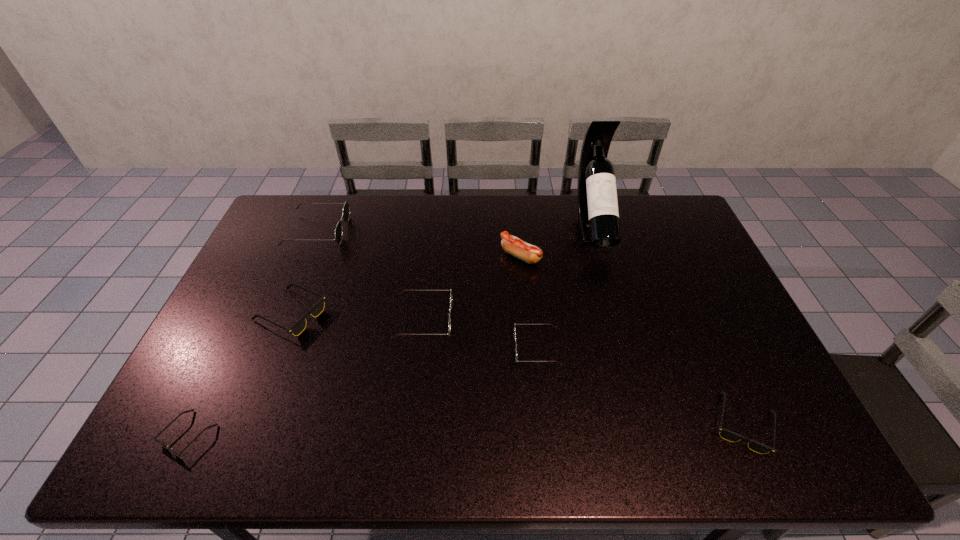
You are a GUI agent. You are given a task and a screenshot of the screen. Output one action in this format:
    pyautogui.click(x=<x>, y=<y>)
    Task: Click on the free space in the image that satisfies the following two spatial constraints: 1. on the front-facing side of the tallest sunglasses; 2. on the lenses of the smallest black sunglasses
    This screenshot has height=540, width=960.
    Given the screenshot: What is the action you would take?
    (232, 435)

Find the location of `vacant space that satisfies the following two spatial constraints: 1. on the stand of the black wine bottle; 2. on the front-facing side of the farthest green sunglasses`. vacant space that satisfies the following two spatial constraints: 1. on the stand of the black wine bottle; 2. on the front-facing side of the farthest green sunglasses is located at coordinates (594, 231).

You are a GUI agent. You are given a task and a screenshot of the screen. Output one action in this format:
    pyautogui.click(x=<x>, y=<y>)
    Task: Click on the free location that satisfies the following two spatial constraints: 1. on the stand of the second object from right to left; 2. on the front-facing side of the farthest green sunglasses
    The image size is (960, 540).
    Given the screenshot: What is the action you would take?
    pyautogui.click(x=594, y=231)

Locate an element on the screen. vacant space that satisfies the following two spatial constraints: 1. on the front side of the sausage; 2. on the lenses of the biggest black sunglasses is located at coordinates tap(526, 314).